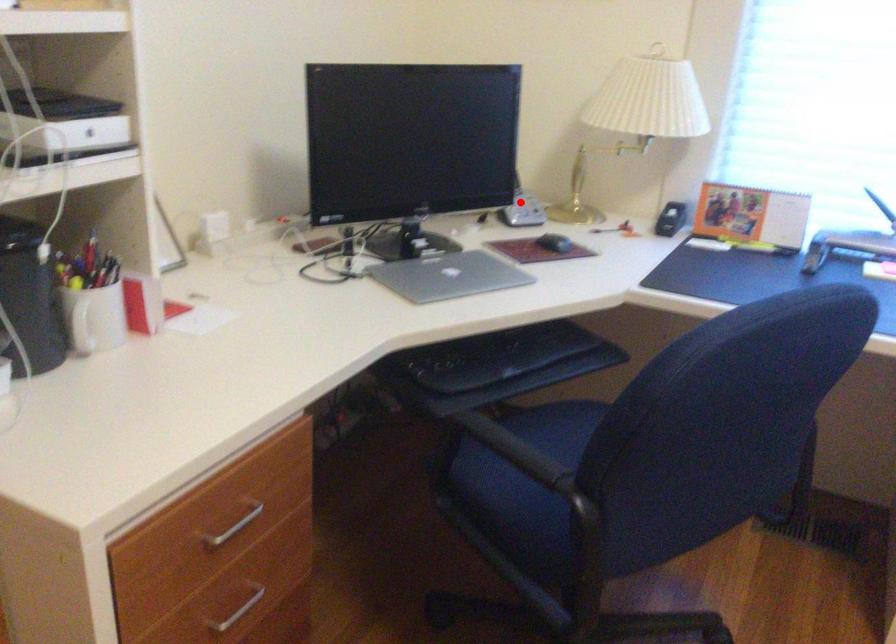
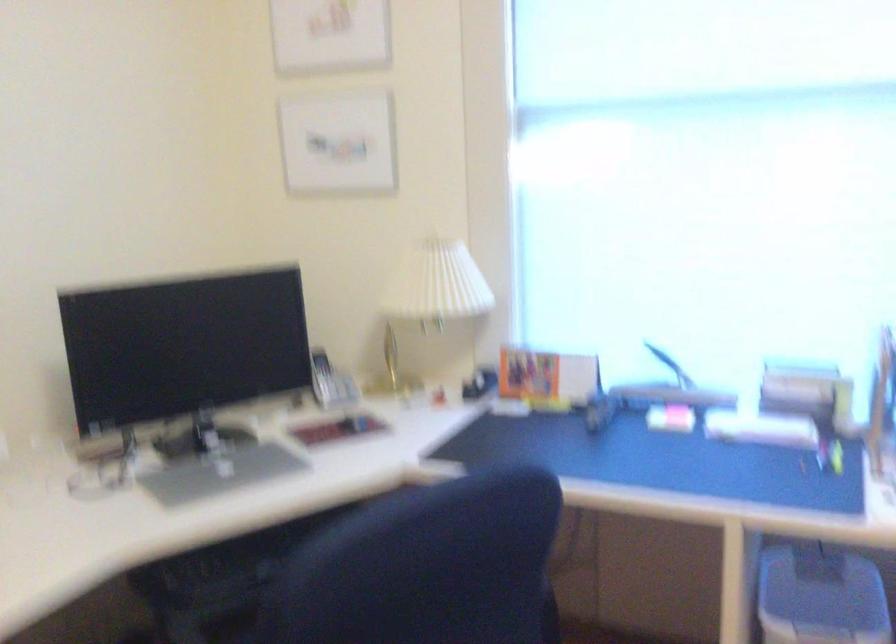
The point at the highlighted location is marked in the first image. Where is the corresponding point in the second image?

(330, 382)